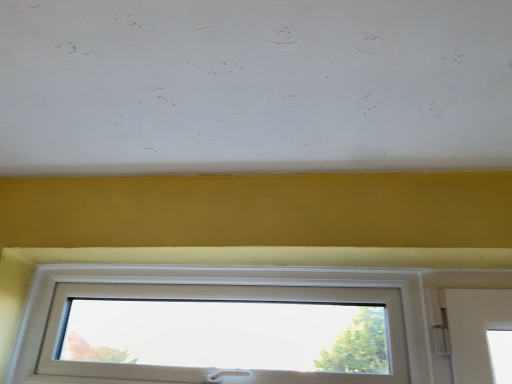
Where is `white plastic window at center`? white plastic window at center is located at coordinates (250, 284).

Measure the distance between point (154, 275) and camera.

The distance of point (154, 275) from camera is 4.47 feet.

What do you see at coordinates (250, 284) in the screenshot? The image size is (512, 384). I see `white plastic window at center` at bounding box center [250, 284].

The width and height of the screenshot is (512, 384). Find the location of `white plastic window at center`. white plastic window at center is located at coordinates (250, 284).